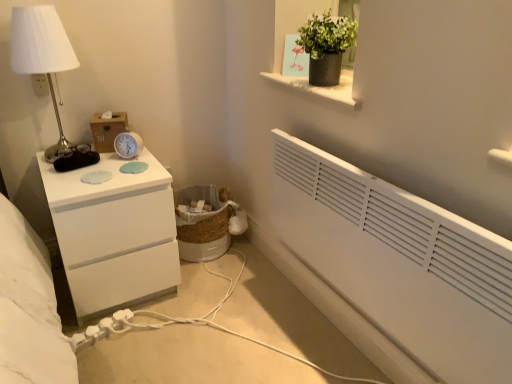
Describe the element at coordinates (203, 223) in the screenshot. The image size is (512, 384). I see `woven natural laundry basket at lower center` at that location.

In order to click on woven natural laundry basket at lower center in this screenshot , I will do `click(203, 223)`.

The width and height of the screenshot is (512, 384). What do you see at coordinates (114, 234) in the screenshot? I see `white glossy chest of drawers at left` at bounding box center [114, 234].

What is the approximate width of white glossy chest of drawers at left?

white glossy chest of drawers at left is 20.61 inches in width.

Where is `matte black pot at upper center`? matte black pot at upper center is located at coordinates (326, 46).

Where is `woven natural laundry basket at lower center`? The width and height of the screenshot is (512, 384). woven natural laundry basket at lower center is located at coordinates (203, 223).

From a real-world perspective, who is located lower, white plastic electric outlet at upper left or woven natural laundry basket at lower center?

woven natural laundry basket at lower center.

Can you confirm if white plastic electric outlet at upper left is positioned to the right of woven natural laundry basket at lower center?

In fact, white plastic electric outlet at upper left is to the left of woven natural laundry basket at lower center.

Is point (40, 78) closer or farther from the camera than point (177, 226)?

Clearly, point (40, 78) is closer to the camera than point (177, 226).

From a real-world perspective, is white metallic table lamp at left physically below woven natural laundry basket at lower center?

No, from a real-world perspective, white metallic table lamp at left is not under woven natural laundry basket at lower center.

Considering the relative positions of white metallic table lamp at left and woven natural laundry basket at lower center in the image provided, is white metallic table lamp at left in front of woven natural laundry basket at lower center?

Yes, the depth of white metallic table lamp at left is less than that of woven natural laundry basket at lower center.

Consider the image. Is woven natural laundry basket at lower center surrounded by white metallic table lamp at left?

Actually, woven natural laundry basket at lower center is outside white metallic table lamp at left.

Where is `laundry basket below the white metallic table lamp at left (from the image's perspective)`? laundry basket below the white metallic table lamp at left (from the image's perspective) is located at coordinates (203, 223).

Image resolution: width=512 pixels, height=384 pixels. Identify the location of the chest of drawers lying in front of the white plastic extension cord at lower left. (114, 234).

Considering the positions of objects white glossy chest of drawers at left and white plastic extension cord at lower left in the image provided, who is behind, white glossy chest of drawers at left or white plastic extension cord at lower left?

white plastic extension cord at lower left is further from the camera.

From the image's perspective, is white glossy chest of drawers at left below white plastic extension cord at lower left?

No, from the image's perspective, white glossy chest of drawers at left is not beneath white plastic extension cord at lower left.

Between white glossy chest of drawers at left and white plastic extension cord at lower left, which one appears on the right side from the viewer's perspective?

white plastic extension cord at lower left.

Which object is positioned more to the right, white plastic alarm clock at upper left or white plastic electric outlet at upper left?

Positioned to the right is white plastic alarm clock at upper left.

Image resolution: width=512 pixels, height=384 pixels. Find the location of `alarm clock that appears in front of the white plastic electric outlet at upper left`. alarm clock that appears in front of the white plastic electric outlet at upper left is located at coordinates (128, 145).

From a real-world perspective, is white plastic alarm clock at upper left located higher than white plastic electric outlet at upper left?

No.

From the image's perspective, is white plastic alarm clock at upper left on white plastic electric outlet at upper left?

Actually, white plastic alarm clock at upper left appears below white plastic electric outlet at upper left in the image.

Is there a large distance between matte black pot at upper center and white plastic electric outlet at upper left?

matte black pot at upper center is far away from white plastic electric outlet at upper left.

Can you confirm if matte black pot at upper center is taller than white plastic electric outlet at upper left?

Correct, matte black pot at upper center is much taller as white plastic electric outlet at upper left.

Is point (327, 46) less distant than point (36, 80)?

That is True.

From a real-world perspective, is matte black pot at upper center located beneath white plastic electric outlet at upper left?

No.

Looking at their sizes, would you say wooden tissue box at upper left is wider or thinner than white metallic table lamp at left?

wooden tissue box at upper left is thinner than white metallic table lamp at left.

Between wooden tissue box at upper left and white metallic table lamp at left, which one appears on the left side from the viewer's perspective?

white metallic table lamp at left is more to the left.

Are wooden tissue box at upper left and white metallic table lamp at left located far from each other?

No, there isn't a large distance between wooden tissue box at upper left and white metallic table lamp at left.

From the image's perspective, which object appears higher, wooden tissue box at upper left or white metallic table lamp at left?

white metallic table lamp at left appears higher in the image.

Is white glossy chest of drawers at left beside wooden tissue box at upper left?

No, white glossy chest of drawers at left is not next to wooden tissue box at upper left.

Which object is wider, white glossy chest of drawers at left or wooden tissue box at upper left?

With larger width is white glossy chest of drawers at left.

This screenshot has width=512, height=384. I want to click on laundry basket behind the white plastic electric outlet at upper left, so click(203, 223).

Locate an element on the screen. The width and height of the screenshot is (512, 384). table lamp in front of the woven natural laundry basket at lower center is located at coordinates (42, 56).

When comparing their distances from wooden tissue box at upper left, does white metallic table lamp at left or white plastic extension cord at lower left seem further?

white plastic extension cord at lower left.

When comparing their distances from white glossy chest of drawers at left, does white plastic alarm clock at upper left or wooden tissue box at upper left seem further?

Among the two, wooden tissue box at upper left is located further to white glossy chest of drawers at left.

Considering their positions, is wooden tissue box at upper left positioned further to white plastic electric outlet at upper left than white metallic table lamp at left?

The object further to white plastic electric outlet at upper left is wooden tissue box at upper left.

Considering their positions, is woven natural laundry basket at lower center positioned further to matte black pot at upper center than white glossy chest of drawers at left?

woven natural laundry basket at lower center lies further to matte black pot at upper center than the other object.

Estimate the real-world distances between objects in this image. Which object is further from woven natural laundry basket at lower center, white plastic alarm clock at upper left or white glossy chest of drawers at left?

Based on the image, white plastic alarm clock at upper left appears to be further to woven natural laundry basket at lower center.

When comparing their distances from white glossy chest of drawers at left, does matte black pot at upper center or white plastic alarm clock at upper left seem closer?

white plastic alarm clock at upper left is closer to white glossy chest of drawers at left.

Considering their positions, is white glossy chest of drawers at left positioned closer to white plastic alarm clock at upper left than white metallic table lamp at left?

white glossy chest of drawers at left is positioned closer to the anchor white plastic alarm clock at upper left.

Looking at the image, which one is located further to woven natural laundry basket at lower center, white metallic table lamp at left or white plastic alarm clock at upper left?

Based on the image, white metallic table lamp at left appears to be further to woven natural laundry basket at lower center.

Locate an element on the screen. box located between white plastic electric outlet at upper left and white plastic alarm clock at upper left in the left-right direction is located at coordinates (106, 130).

Identify the location of box that lies between white plastic electric outlet at upper left and white plastic extension cord at lower left from top to bottom. Image resolution: width=512 pixels, height=384 pixels. (106, 130).

This screenshot has width=512, height=384. What are the coordinates of `laundry basket that lies between white metallic table lamp at left and white plastic extension cord at lower left from top to bottom` in the screenshot? It's located at (203, 223).

Identify the location of alarm clock between matte black pot at upper center and white plastic extension cord at lower left in the up-down direction. This screenshot has height=384, width=512. tap(128, 145).